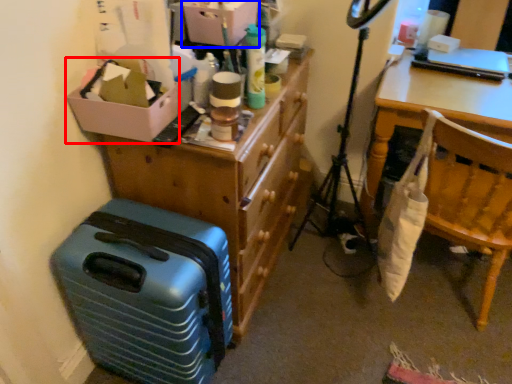
Question: Which object appears farthest to the camera in this image, box (highlighted by a red box) or storage box (highlighted by a blue box)?

Choices:
 (A) box
 (B) storage box

Answer: (B)